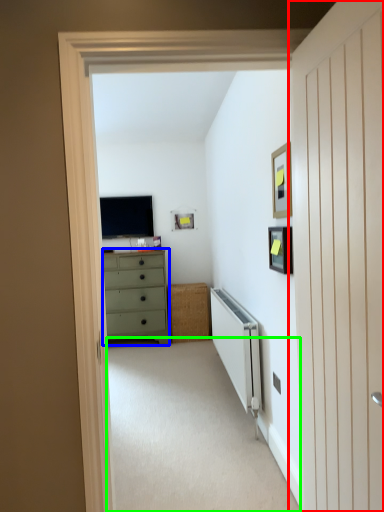
Question: Estimate the real-world distances between objects in this image. Which object is closer to door (highlighted by a red box), chest of drawers (highlighted by a blue box) or corridor (highlighted by a green box)?

Choices:
 (A) chest of drawers
 (B) corridor

Answer: (B)